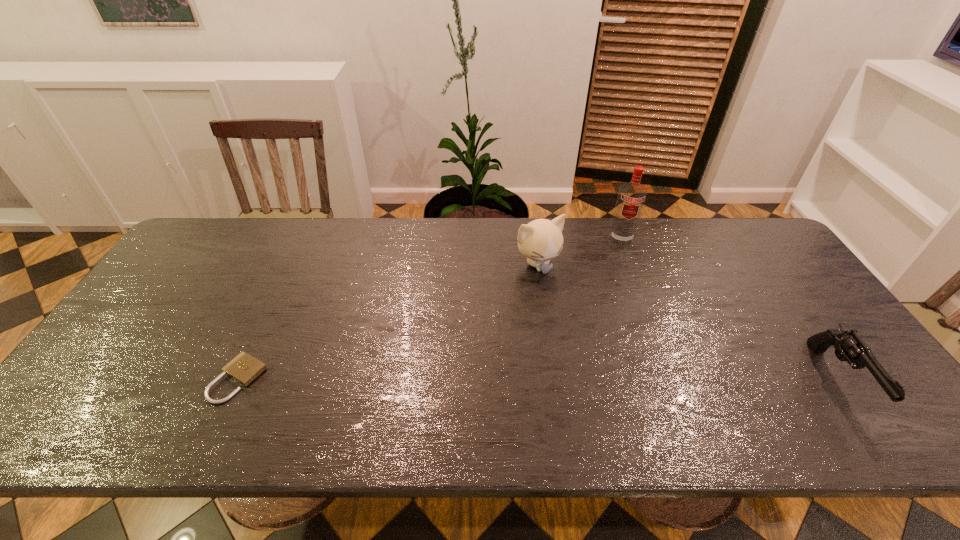
You are a GUI agent. You are given a task and a screenshot of the screen. Output one action in this format:
    pyautogui.click(x=<x>, y=<y>)
    Task: Click on the blank space located on the face of the third object from right to left
    
    Given the screenshot: What is the action you would take?
    pyautogui.click(x=606, y=353)

The width and height of the screenshot is (960, 540). What are the coordinates of `vacant space located 0.060m on the face of the third object from right to left` in the screenshot? It's located at (559, 291).

Identify the location of vacant space located 0.130m on the front label of the third object from left to right. This screenshot has height=540, width=960. (622, 273).

You are a GUI agent. You are given a task and a screenshot of the screen. Output one action in this format:
    pyautogui.click(x=<x>, y=<y>)
    Task: Click on the vacant area situated 0.070m on the front label of the third object from left to right
    The image size is (960, 540).
    Given the screenshot: What is the action you would take?
    (x=621, y=261)

This screenshot has height=540, width=960. I want to click on vacant space located on the front label of the third object from left to right, so click(x=624, y=320).

Find the location of a particular element. kitten present at the far edge is located at coordinates (541, 240).

You are a GUI agent. You are given a task and a screenshot of the screen. Output one action in this format:
    pyautogui.click(x=<x>, y=<y>)
    Task: Click on the vodka situated at the far edge
    The height and width of the screenshot is (540, 960).
    Given the screenshot: What is the action you would take?
    pyautogui.click(x=631, y=197)

Locate an element on the screen. The width and height of the screenshot is (960, 540). padlock that is positioned at the near edge is located at coordinates (244, 368).

Locate an element on the screen. gun present at the near edge is located at coordinates (849, 346).

Find the location of a particular element. object present at the right edge is located at coordinates (849, 346).